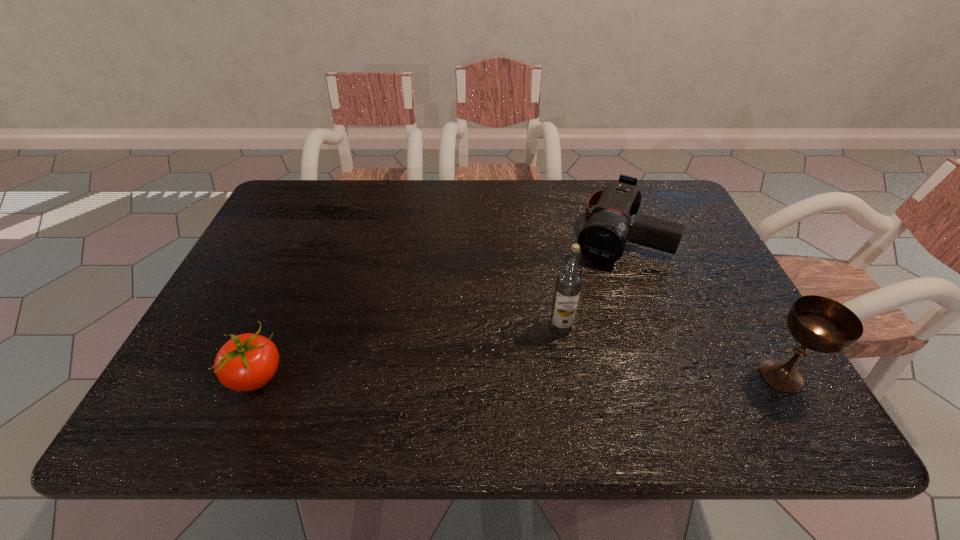
This screenshot has width=960, height=540. I want to click on camcorder that is at the right edge, so click(603, 239).

Locate an element on the screen. The image size is (960, 540). object present at the near left corner is located at coordinates [x=247, y=362].

Locate an element on the screen. Image resolution: width=960 pixels, height=540 pixels. object positioned at the far right corner is located at coordinates (603, 239).

You are a GUI agent. You are given a task and a screenshot of the screen. Output one action in this format:
    pyautogui.click(x=<x>, y=<y>)
    Task: Click on the object present at the near right corner
    This screenshot has width=960, height=540.
    Given the screenshot: What is the action you would take?
    pyautogui.click(x=821, y=324)

Where is `free space at the far edge of the desktop`? This screenshot has height=540, width=960. free space at the far edge of the desktop is located at coordinates (564, 179).

This screenshot has width=960, height=540. In order to click on free region at the near edge of the desktop in this screenshot , I will do `click(389, 359)`.

Where is `vacant space at the left edge of the desktop`? This screenshot has height=540, width=960. vacant space at the left edge of the desktop is located at coordinates (286, 252).

At what (x,y) coordinates should I click in order to perform the action: click on free space at the right edge of the desktop. Please return your answer as a coordinate pair (x, y). Looking at the image, I should click on (687, 272).

In the image, there is a desktop. Where is `vacant space at the far left corner`? The height and width of the screenshot is (540, 960). vacant space at the far left corner is located at coordinates (291, 184).

What are the coordinates of `vacant space at the far right corner` in the screenshot? It's located at (674, 192).